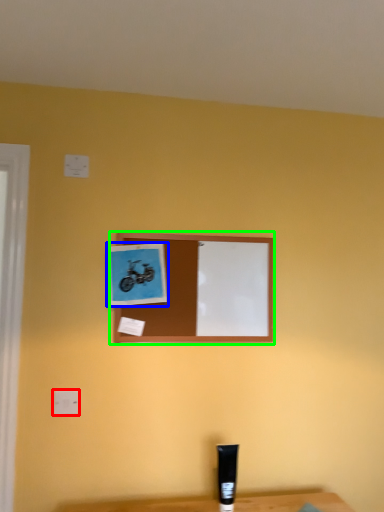
Question: Which is nearer to the electric outlet (highlighted by a red box)? picture frame (highlighted by a blue box) or picture frame (highlighted by a green box).

Choices:
 (A) picture frame
 (B) picture frame

Answer: (A)